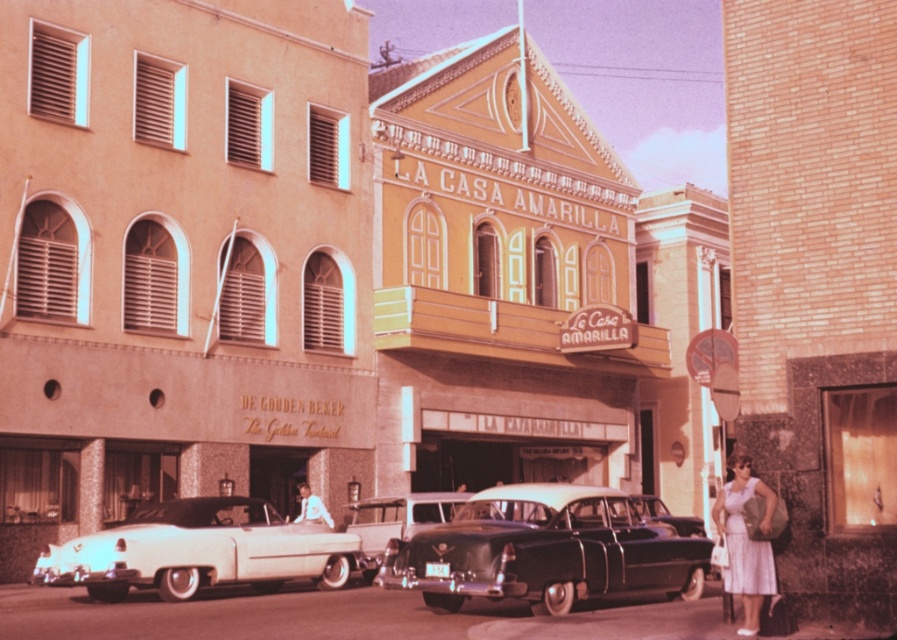
You are a photographer standing at the camera position. You want to take a closeup shot of the shiny silver sedan at center. However, you can only move forward 20 meters. Will you be able to get a closer shot?

The shiny silver sedan at center is 35.90 meters away from camera. Moving forward 20 meters would bring you to 15.90 meters away, so yes, you can get a closer shot.